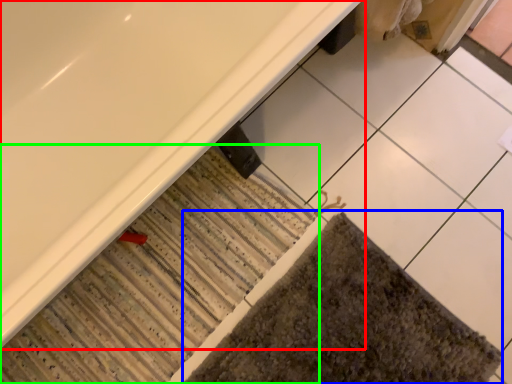
Question: Based on their relative distances, which object is nearer to bathtub (highlighted by a red box)? Choose from bath mat (highlighted by a blue box) and bath mat (highlighted by a green box).

Choices:
 (A) bath mat
 (B) bath mat

Answer: (B)